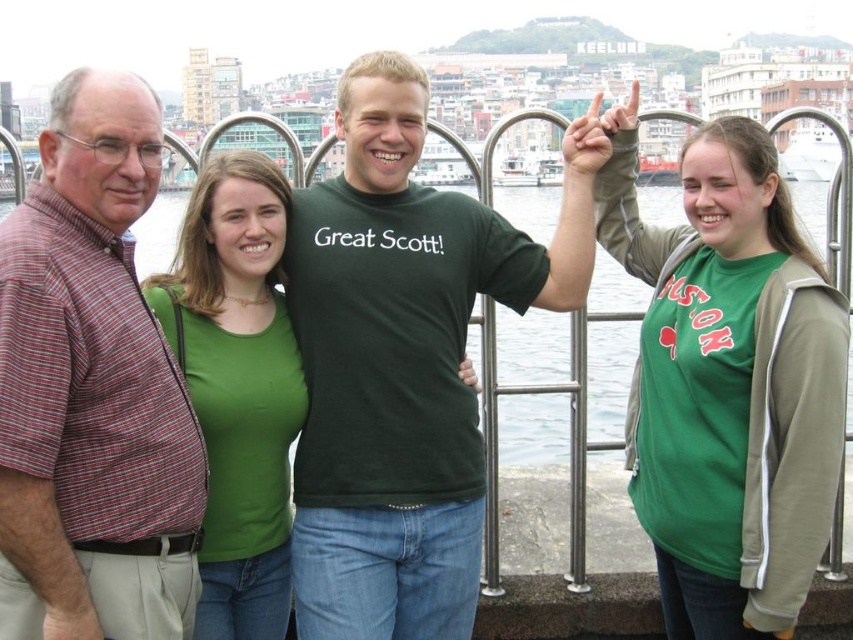
Does green matte shirt at upper right appear on the right side of green matte shirt at center?

Indeed, green matte shirt at upper right is positioned on the right side of green matte shirt at center.

Between green matte shirt at upper right and green matte shirt at center, which one appears on the left side from the viewer's perspective?

green matte shirt at center is more to the left.

Does point (746, 589) come farther from viewer compared to point (263, 390)?

No, it is not.

Locate an element on the screen. The width and height of the screenshot is (853, 640). green matte shirt at upper right is located at coordinates (744, 371).

Is point (9, 332) behind point (286, 624)?

That is False.

Between striped cotton shirt at left and green matte shirt at center, which one is positioned higher?

Positioned higher is striped cotton shirt at left.

Find the location of `striped cotton shirt at left`. striped cotton shirt at left is located at coordinates [x=91, y=387].

Identify the location of striped cotton shirt at left. (91, 387).

Measure the distance between striped cotton shirt at left and green matte shirt at upper right.

striped cotton shirt at left is 26.25 meters away from green matte shirt at upper right.

Who is more distant from viewer, (132, 611) or (801, 515)?

Positioned behind is point (801, 515).

Is point (183, 604) closer to viewer compared to point (842, 374)?

That is True.

You are a GUI agent. You are given a task and a screenshot of the screen. Output one action in this format:
    pyautogui.click(x=<x>, y=<y>)
    Task: Click on the striped cotton shirt at left
    This screenshot has width=853, height=640.
    Given the screenshot: What is the action you would take?
    pyautogui.click(x=91, y=387)